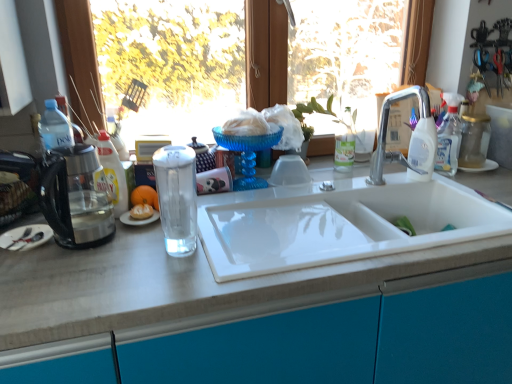
Locate an element on the screen. The height and width of the screenshot is (384, 512). vacant space that's between white glossy bottle at upper right and white fluffy food at center is located at coordinates (301, 194).